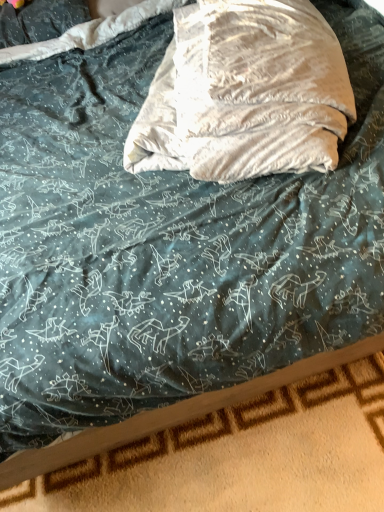
This screenshot has width=384, height=512. What do you see at coordinates (245, 94) in the screenshot?
I see `beige velvety throw pillow at center` at bounding box center [245, 94].

Locate an element on the screen. The image size is (384, 512). beige velvety throw pillow at center is located at coordinates (245, 94).

This screenshot has width=384, height=512. I want to click on wooden bed frame at bottom, so click(242, 456).

What do you see at coordinates (242, 456) in the screenshot? I see `wooden bed frame at bottom` at bounding box center [242, 456].

Where is `beige velvety throw pillow at center`? This screenshot has height=512, width=384. beige velvety throw pillow at center is located at coordinates (245, 94).

Considering the relative positions of beige velvety throw pillow at center and wooden bed frame at bottom in the image provided, is beige velvety throw pillow at center to the left or to the right of wooden bed frame at bottom?

In the image, beige velvety throw pillow at center appears on the right side of wooden bed frame at bottom.

Relative to wooden bed frame at bottom, is beige velvety throw pillow at center in front or behind?

In the image, beige velvety throw pillow at center appears in front of wooden bed frame at bottom.

Does point (254, 106) lie behind point (312, 455)?

No, it is not.

From the picture: From the image's perspective, is beige velvety throw pillow at center on top of wooden bed frame at bottom?

Indeed, from the image's perspective, beige velvety throw pillow at center is shown above wooden bed frame at bottom.

From a real-world perspective, is beige velvety throw pillow at center positioned under wooden bed frame at bottom based on gravity?

No.

Which of these two, beige velvety throw pillow at center or wooden bed frame at bottom, is wider?

Wider between the two is beige velvety throw pillow at center.

Does beige velvety throw pillow at center have a greater height compared to wooden bed frame at bottom?

Indeed, beige velvety throw pillow at center has a greater height compared to wooden bed frame at bottom.

Based on their sizes in the image, would you say beige velvety throw pillow at center is bigger or smaller than wooden bed frame at bottom?

beige velvety throw pillow at center is bigger than wooden bed frame at bottom.

Could wooden bed frame at bottom be considered to be inside beige velvety throw pillow at center?

No.

Are beige velvety throw pillow at center and wooden bed frame at bottom located far from each other?

No, beige velvety throw pillow at center is in close proximity to wooden bed frame at bottom.

Is beige velvety throw pillow at center facing towards wooden bed frame at bottom?

No.

How different are the orientations of beige velvety throw pillow at center and wooden bed frame at bottom in degrees?

The angular difference between beige velvety throw pillow at center and wooden bed frame at bottom is 153 degrees.

Locate an element on the screen. throw pillow that appears in front of the wooden bed frame at bottom is located at coordinates (245, 94).

In the image, is wooden bed frame at bottom on the left side or the right side of beige velvety throw pillow at center?

In the image, wooden bed frame at bottom appears on the left side of beige velvety throw pillow at center.

Which object is closer to the camera, wooden bed frame at bottom or beige velvety throw pillow at center?

beige velvety throw pillow at center is more forward.

Does point (237, 444) appear closer or farther from the camera than point (219, 21)?

Point (237, 444) is positioned closer to the camera compared to point (219, 21).

From the image's perspective, is wooden bed frame at bottom located above beige velvety throw pillow at center?

Actually, wooden bed frame at bottom appears below beige velvety throw pillow at center in the image.

From a real-world perspective, does wooden bed frame at bottom sit lower than beige velvety throw pillow at center?

Yes, from a real-world perspective, wooden bed frame at bottom is below beige velvety throw pillow at center.

Considering the relative sizes of wooden bed frame at bottom and beige velvety throw pillow at center in the image provided, is wooden bed frame at bottom thinner than beige velvety throw pillow at center?

Yes.

Can you confirm if wooden bed frame at bottom is shorter than beige velvety throw pillow at center?

Indeed, wooden bed frame at bottom has a lesser height compared to beige velvety throw pillow at center.

Is wooden bed frame at bottom smaller than beige velvety throw pillow at center?

Indeed, wooden bed frame at bottom has a smaller size compared to beige velvety throw pillow at center.

Is wooden bed frame at bottom located outside beige velvety throw pillow at center?

wooden bed frame at bottom is positioned outside beige velvety throw pillow at center.

Is wooden bed frame at bottom beside beige velvety throw pillow at center?

wooden bed frame at bottom and beige velvety throw pillow at center are clearly separated.

Is wooden bed frame at bottom looking in the opposite direction of beige velvety throw pillow at center?

No, wooden bed frame at bottom is not facing the opposite direction of beige velvety throw pillow at center.

How different are the orientations of wooden bed frame at bottom and beige velvety throw pillow at center in degrees?

153 degrees separate the facing orientations of wooden bed frame at bottom and beige velvety throw pillow at center.

This screenshot has width=384, height=512. I want to click on throw pillow to the right of wooden bed frame at bottom, so click(x=245, y=94).

The width and height of the screenshot is (384, 512). In order to click on throw pillow that is above the wooden bed frame at bottom (from a real-world perspective) in this screenshot , I will do `click(245, 94)`.

The image size is (384, 512). Find the location of `bed frame to the left of beige velvety throw pillow at center`. bed frame to the left of beige velvety throw pillow at center is located at coordinates (242, 456).